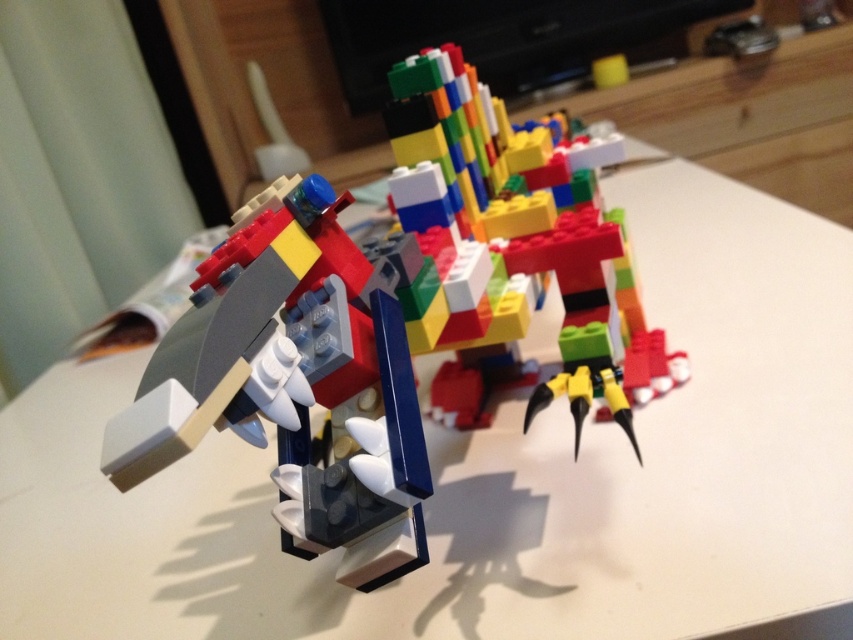
Consider the image. You are trying to assemble a LEGO dragon set and have the matte plastic lego dragon at center and the multicolored plastic blocks at center in front of you. According to the instructions, the dragon should be placed to the right of the blocks. Is the current arrangement correct?

The matte plastic lego dragon at center is positioned on the left side of multicolored plastic blocks at center, so the current arrangement is incorrect because the dragon should be to the right of the blocks as per the instructions.

You are positioning a camera to photograph the matte plastic lego dragon at center. The camera is set up at point A, which is at coordinates 0.5, 0.5. Will the dragon be centered in the photo?

The matte plastic lego dragon at center is located at point (293, 385), which is slightly to the right and below the camera position at (426, 320). Therefore, the dragon will not be perfectly centered in the photo.

You are trying to determine if the matte plastic lego dragon at center can be moved to a smaller shelf that currently holds the multicolored plastic blocks at center. Based on their sizes, will the dragon fit on the shelf without needing to remove any blocks?

The matte plastic lego dragon at center occupies less space than multicolored plastic blocks at center, so it should fit on the shelf without needing to remove any blocks since it takes up less space.